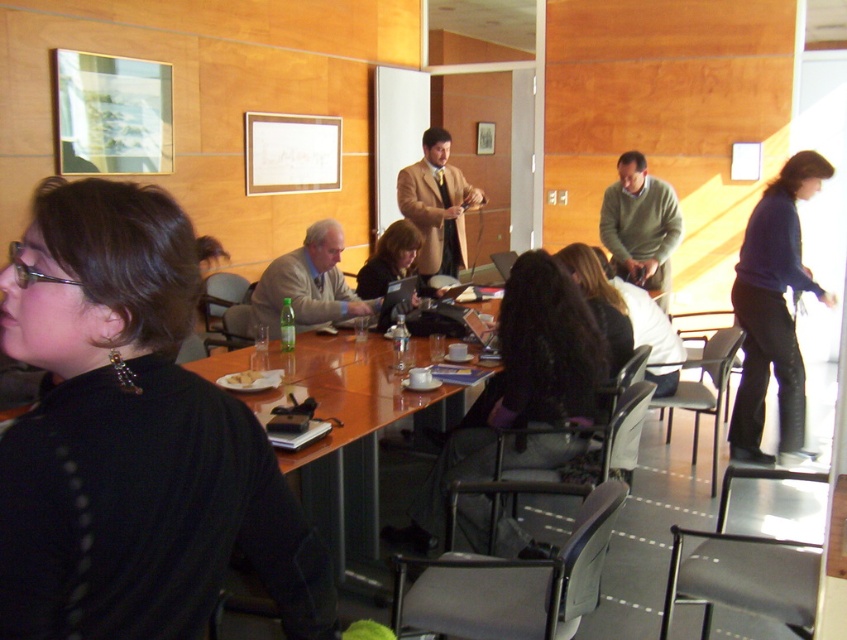
Question: Which point is closer to the camera?

Choices:
 (A) (253, 378)
 (B) (379, 269)
 (C) (412, 522)
 (D) (313, 509)

Answer: (A)

Question: Can you confirm if black fabric jacket at center is positioned above white crumbly bread at table center?

Choices:
 (A) yes
 (B) no

Answer: (B)

Question: Based on their relative distances, which object is farther from the dark blue sweater at right?

Choices:
 (A) matte black laptop at center
 (B) white crumbly bread at table center

Answer: (B)

Question: Does dark blue sweater at right have a smaller size compared to matte black laptop at center?

Choices:
 (A) no
 (B) yes

Answer: (A)

Question: Is black matte sweater at left in front of matte black laptop at center?

Choices:
 (A) yes
 (B) no

Answer: (A)

Question: Among these points, which one is nearest to the camera?

Choices:
 (A) (252, 376)
 (B) (751, 387)

Answer: (A)